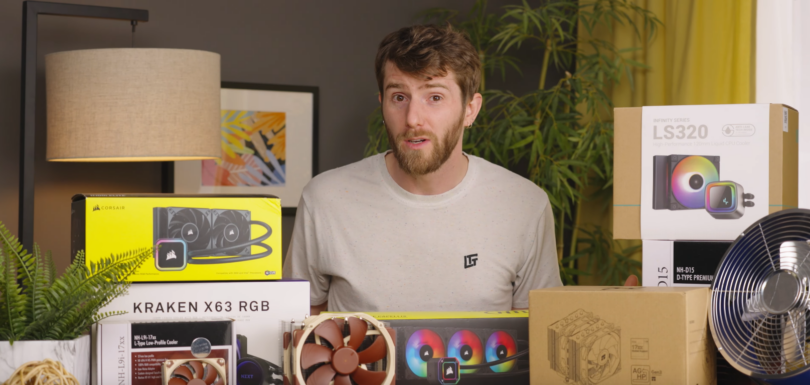
The width and height of the screenshot is (810, 385). Identify the location of green fern plant in planter. (66, 299).